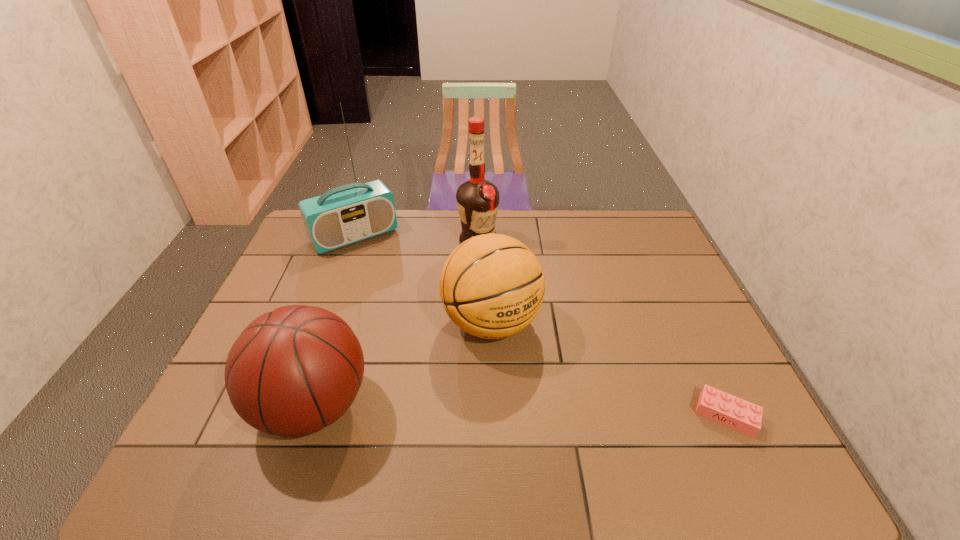
Where is `the left basketball`? The image size is (960, 540). the left basketball is located at coordinates (293, 371).

I want to click on the shortest object, so click(738, 414).

This screenshot has width=960, height=540. Find the location of `Lego`. Lego is located at coordinates (738, 414).

Identify the location of liquor. The height and width of the screenshot is (540, 960). (477, 200).

Identify the location of radio receiver. (350, 213).

The width and height of the screenshot is (960, 540). What are the coordinates of `the right basketball` in the screenshot? It's located at (492, 286).

Where is `free space located on the back of the left basketball`? The image size is (960, 540). free space located on the back of the left basketball is located at coordinates (346, 307).

Identify the location of vacant area located 0.250m on the left of the rightmost object. This screenshot has width=960, height=540. (588, 415).

Locate an element on the screen. vacant space located on the front and back of the liquor is located at coordinates (492, 266).

The image size is (960, 540). I want to click on blank area located on the front and back of the liquor, so click(x=521, y=319).